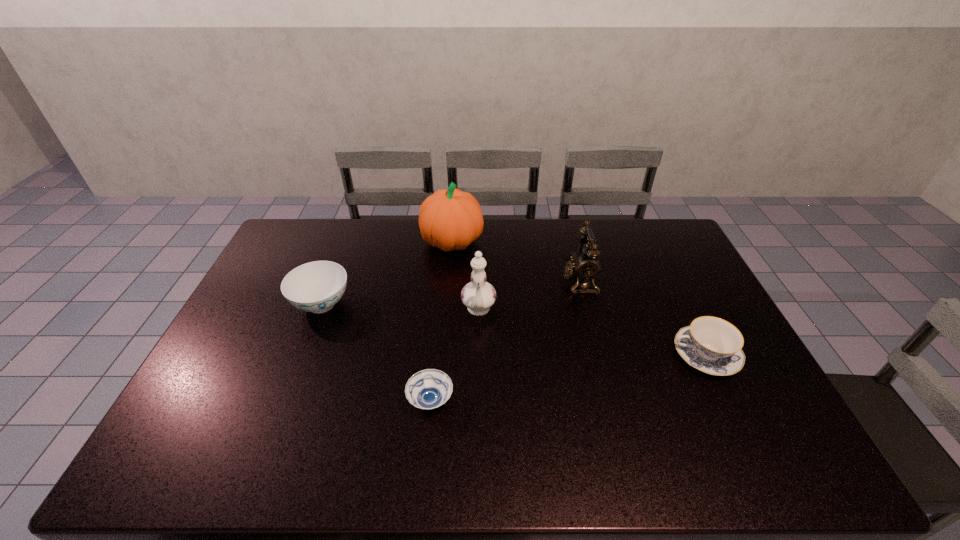
What are the coordinates of `free point at the far edge` in the screenshot? It's located at (551, 236).

In the image, there is a desktop. Identify the location of vacant space at the near edge. (232, 450).

Identify the location of free space at the left edge of the desktop. (245, 362).

Where is `blank space at the right edge`? The width and height of the screenshot is (960, 540). blank space at the right edge is located at coordinates (712, 397).

Where is `free point at the near right corner`? The width and height of the screenshot is (960, 540). free point at the near right corner is located at coordinates (809, 476).

Where is `vacant region between the nearest chinaware and the leftmost object`? The width and height of the screenshot is (960, 540). vacant region between the nearest chinaware and the leftmost object is located at coordinates (514, 329).

Find the location of `vacant area that lies between the telephone and the nearest chinaware`. vacant area that lies between the telephone and the nearest chinaware is located at coordinates (642, 318).

Image resolution: width=960 pixels, height=540 pixels. I want to click on free space between the second chinaware from right to left and the soup bowl, so click(x=454, y=356).

Image resolution: width=960 pixels, height=540 pixels. Find the location of `free space between the leftmost object and the tallest chinaware`. free space between the leftmost object and the tallest chinaware is located at coordinates (400, 307).

Locate an element on the screen. This screenshot has height=540, width=960. vacant space that's between the rightmost chinaware and the leftmost object is located at coordinates tap(514, 329).